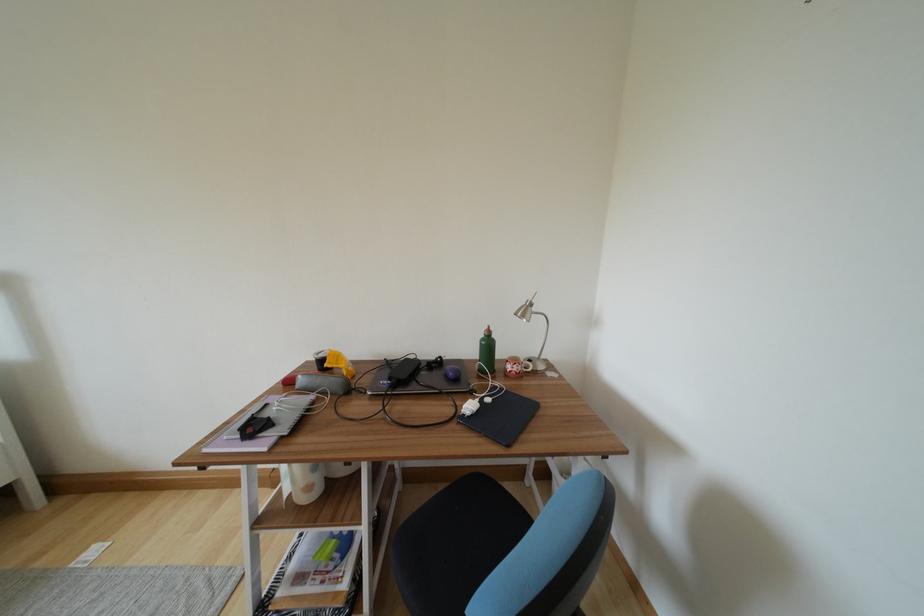
Find where to lift the grey glasses case. Please return your answer as a coordinate pair (x, y).

(322, 383)